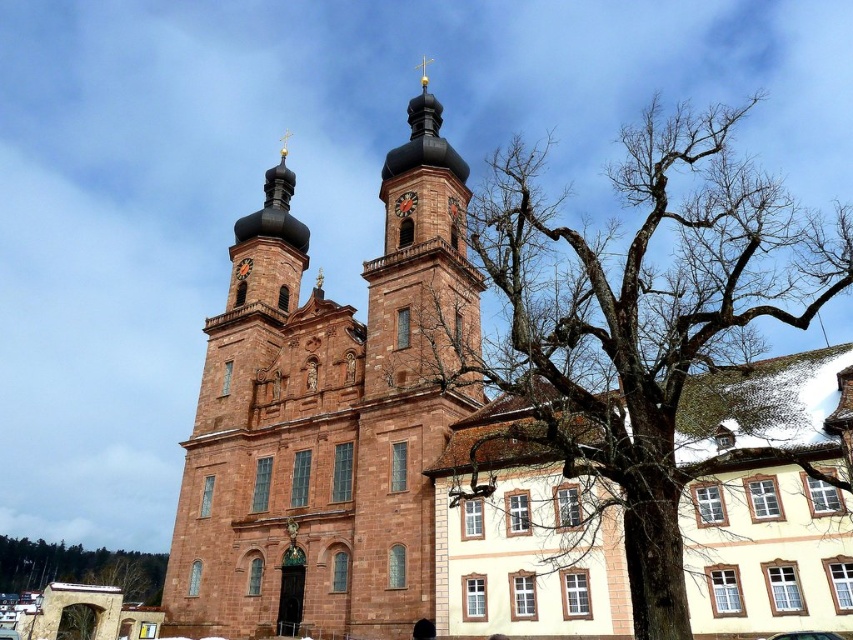
You are standing in front of the church and notice two elements in the scene. One is the bare branches at center and the other is the brown stone tower at center. Which one is located to the right of the other?

The bare branches at center is positioned on the right side of brown stone tower at center.